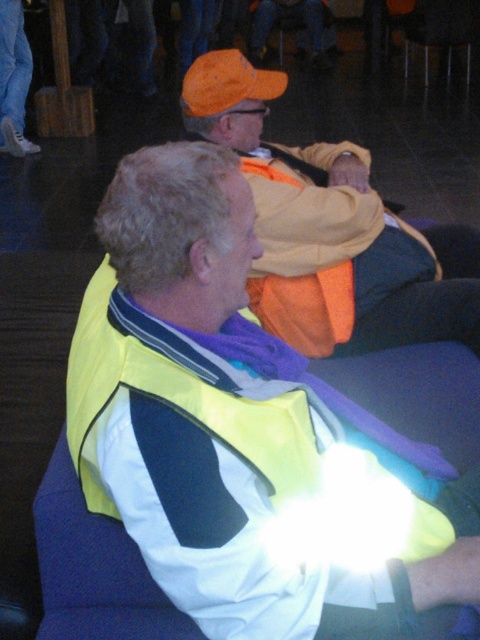
Does orange fabric vest at upper center appear under orange reflective vest at center?

Indeed, orange fabric vest at upper center is positioned under orange reflective vest at center.

Which is more to the right, orange fabric vest at upper center or orange reflective vest at center?

orange reflective vest at center

Between point (321, 273) and point (323, 35), which one is positioned in front?

Point (321, 273)

Image resolution: width=480 pixels, height=640 pixels. I want to click on orange fabric vest at upper center, so click(x=332, y=232).

Between high-visibility fabric vest at center and matte orange cap at upper center, which one has more height?

With more height is matte orange cap at upper center.

Which is below, high-visibility fabric vest at center or matte orange cap at upper center?

high-visibility fabric vest at center

Does point (122, 381) come in front of point (12, 49)?

Yes, point (122, 381) is in front of point (12, 49).

Identify the location of high-visibility fabric vest at center. The height and width of the screenshot is (640, 480). (231, 422).

Is high-visibility fabric vest at center thinner than orange reflective vest at center?

Yes.

Is high-visibility fabric vest at center further to camera compared to orange reflective vest at center?

No.

Is point (285, 358) closer to camera compared to point (325, 22)?

Yes, point (285, 358) is closer to viewer.

At what (x,y) coordinates should I click in order to perform the action: click on high-visibility fabric vest at center. Please return your answer as a coordinate pair (x, y). The image size is (480, 640). Looking at the image, I should click on (231, 422).